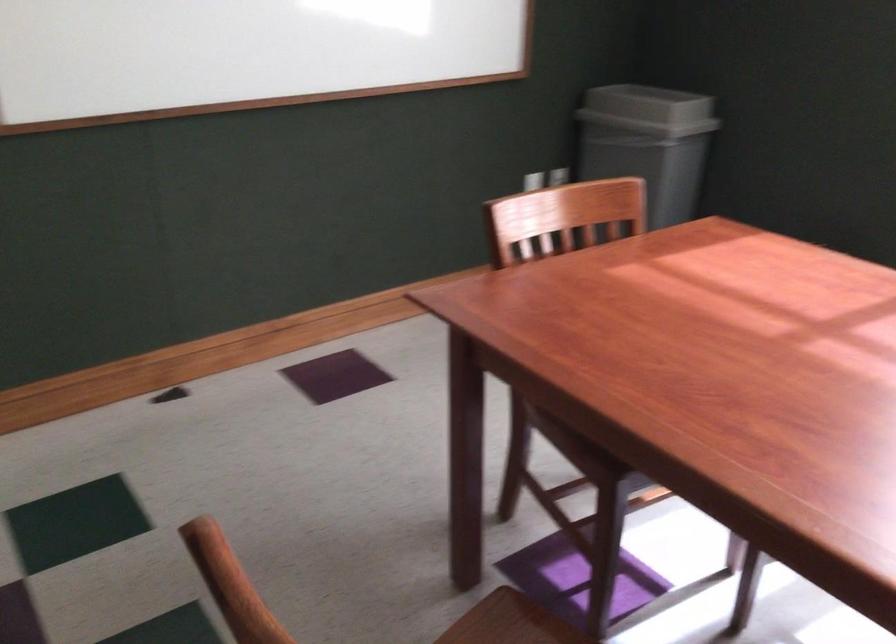
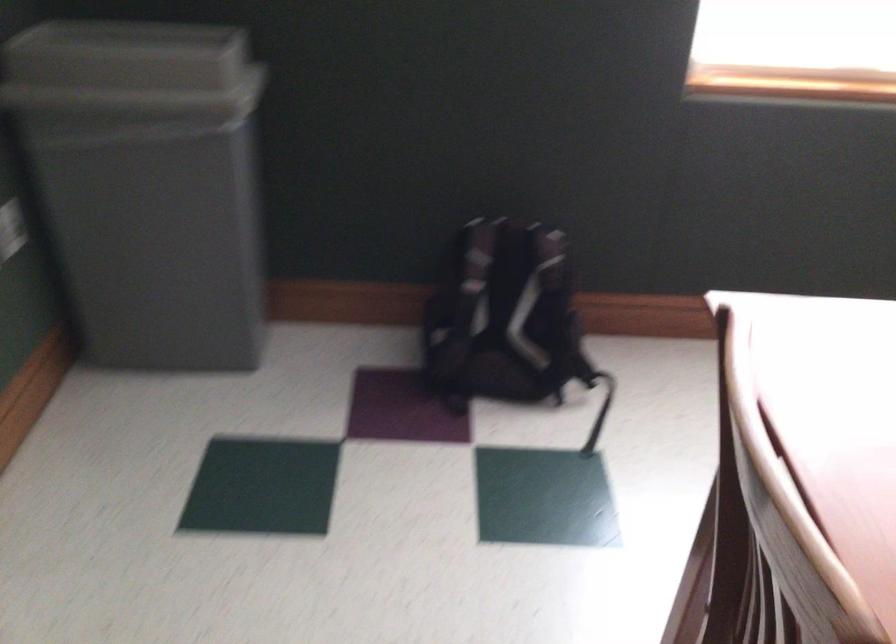
Where in the second image is the point corresponding to pixel 621 104 from the first image?

(131, 71)